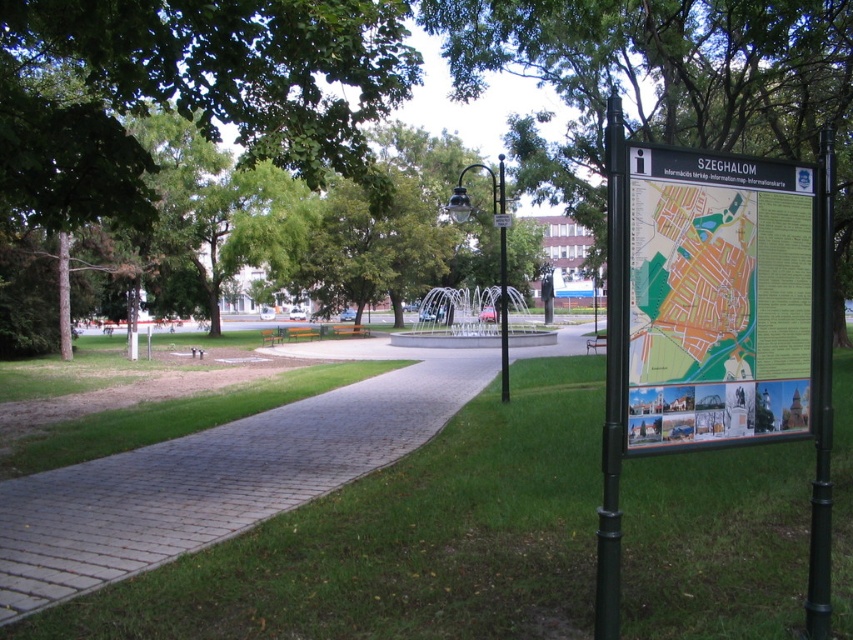
You are standing in the park and want to take a photo of the green leafy tree at center. If your camera has a focusing range up to 10 feet, will you need to move closer or farther away to capture the tree clearly?

The green leafy tree at center is 11.10 feet away from the viewer. Since the camera can focus up to 10 feet, you need to move closer to the tree to be within the camera range.

You are a gardener who needs to trim the trees in the park. You see the green leafy tree at upper left and the green leafy tree at center. Which tree should you prioritize for trimming if you want to work on the taller one first?

The green leafy tree at center is taller than the green leafy tree at upper left, so you should prioritize trimming the green leafy tree at center first.

You are a park visitor who wants to take a photo of both the green leafy tree at upper left and the green leafy tree at center. Which tree should you stand closer to in order to capture both in a single frame?

You should stand closer to the green leafy tree at upper left because it is smaller than the green leafy tree at center. This way, both trees will appear balanced in the photo.